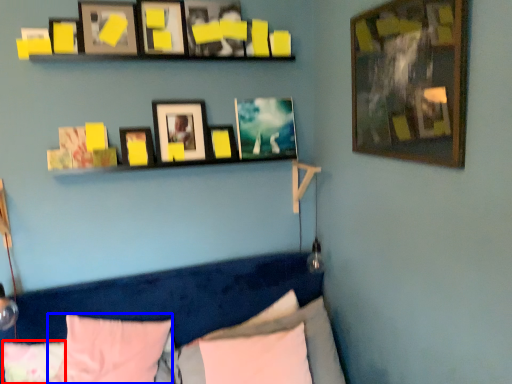
Question: Among these objects, which one is nearest to the camera, pillow (highlighted by a red box) or pillow (highlighted by a blue box)?

Choices:
 (A) pillow
 (B) pillow

Answer: (B)